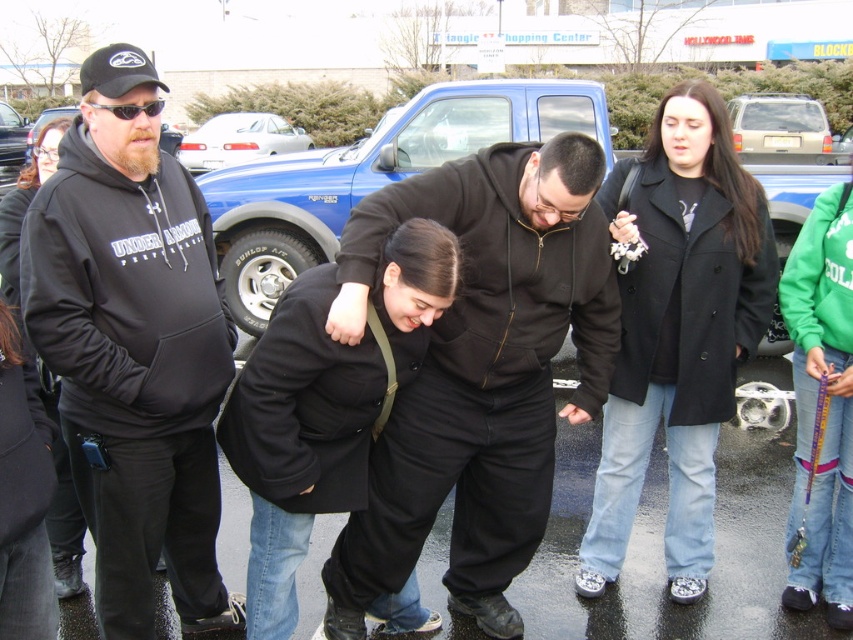
Does point (328, 397) come behind point (55, 417)?

No, (328, 397) is in front of (55, 417).

Where is `black matte coat at center`? black matte coat at center is located at coordinates (323, 406).

Between matte black coat at center and satin silver sedan at upper left, which one is positioned higher?

Positioned higher is satin silver sedan at upper left.

Does matte black coat at center appear under satin silver sedan at upper left?

Correct, matte black coat at center is located below satin silver sedan at upper left.

I want to click on matte black coat at center, so pyautogui.click(x=62, y=502).

The image size is (853, 640). Find the location of `matte black coat at center`. matte black coat at center is located at coordinates 62,502.

Who is more distant from viewer, (729, 147) or (514, 131)?

Point (514, 131)

Is point (709, 176) in front of point (532, 92)?

Yes, it is in front of point (532, 92).

Where is `black wool coat at center`? black wool coat at center is located at coordinates (677, 332).

The image size is (853, 640). I want to click on black wool coat at center, so click(x=677, y=332).